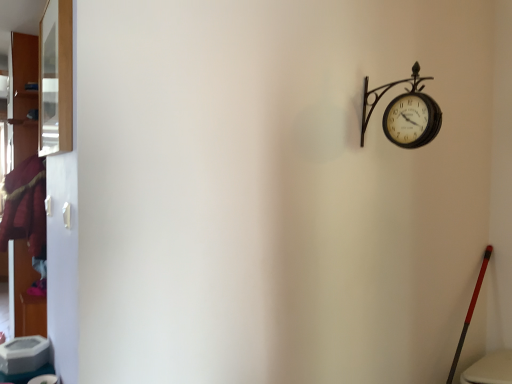
Question: From a real-world perspective, is velvet maroon coat at left positioned above or below metallic black clock at upper right?

Choices:
 (A) above
 (B) below

Answer: (B)

Question: Based on their sizes in the image, would you say velvet maroon coat at left is bigger or smaller than metallic black clock at upper right?

Choices:
 (A) small
 (B) big

Answer: (B)

Question: Which of these objects is positioned closest to the velvet maroon coat at left?

Choices:
 (A) clear glass window at upper left
 (B) metallic black clock at upper right

Answer: (A)

Question: Estimate the real-world distances between objects in this image. Which object is closer to the velvet maroon coat at left?

Choices:
 (A) clear glass window at upper left
 (B) metallic black clock at upper right

Answer: (A)